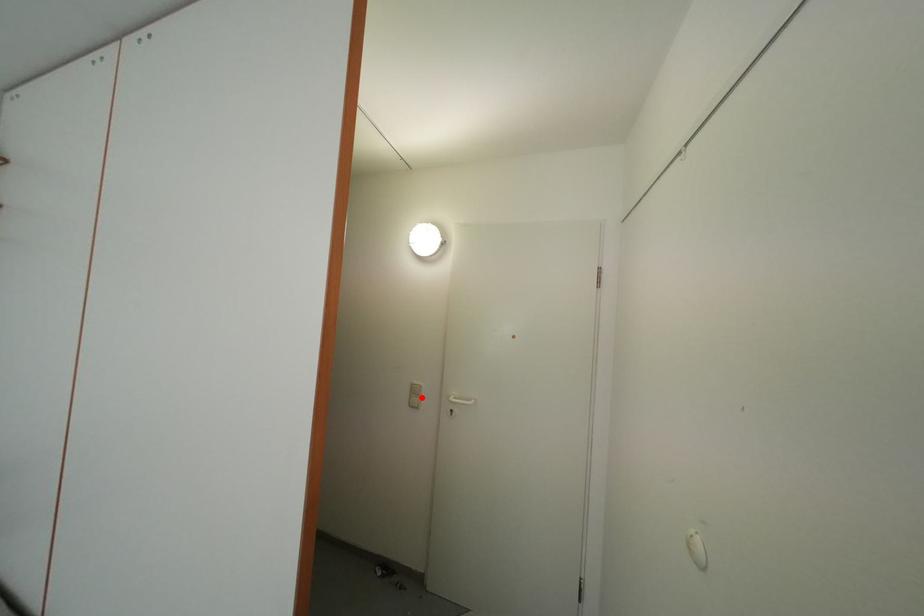
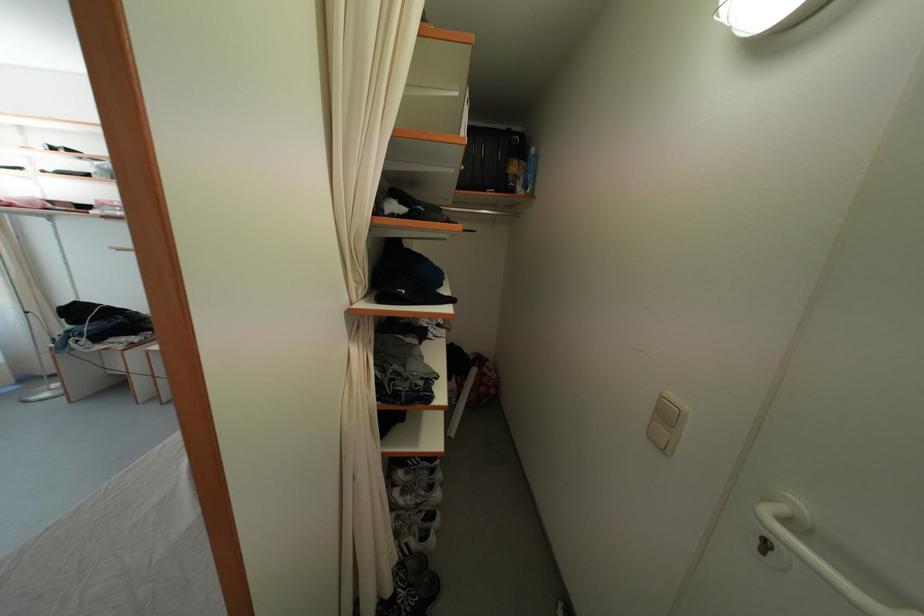
Where in the second image is the point corresponding to the highlighted location from the first image?

(672, 421)